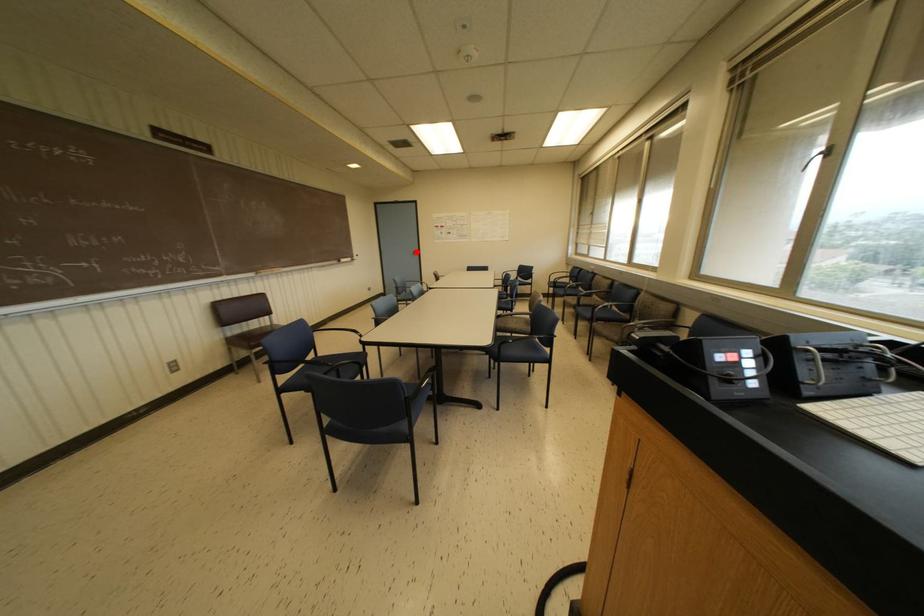
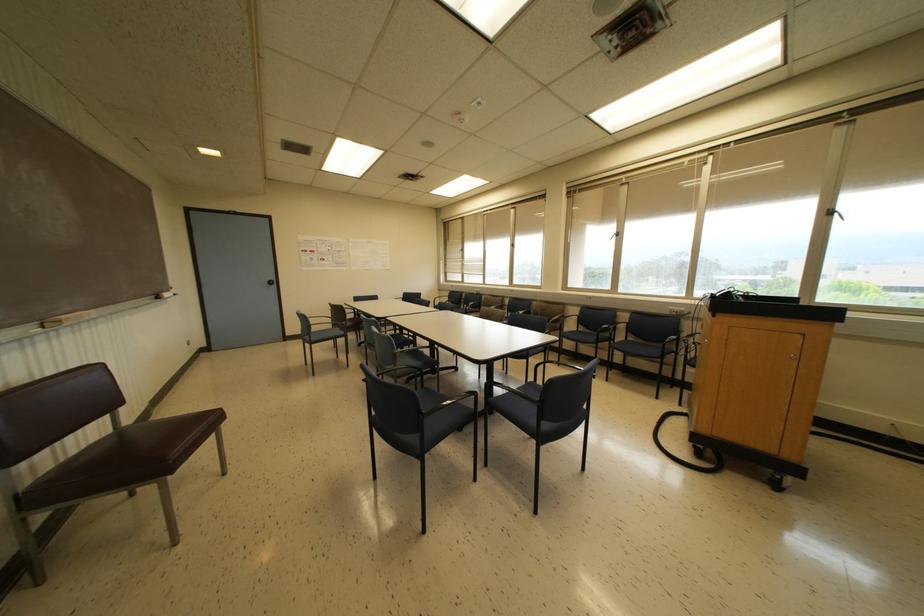
Where in the second image is the point corresponding to the highlighted location from the first image?

(274, 282)